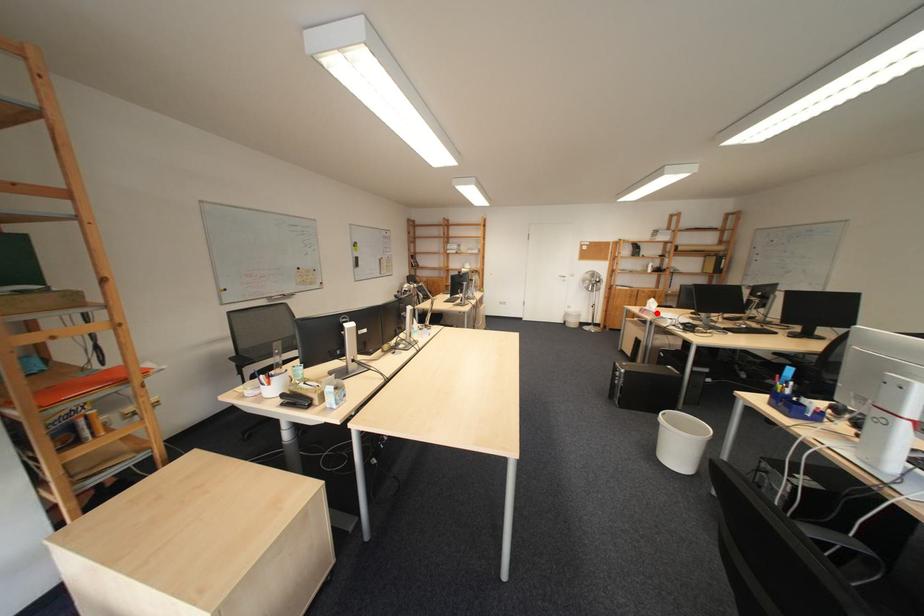
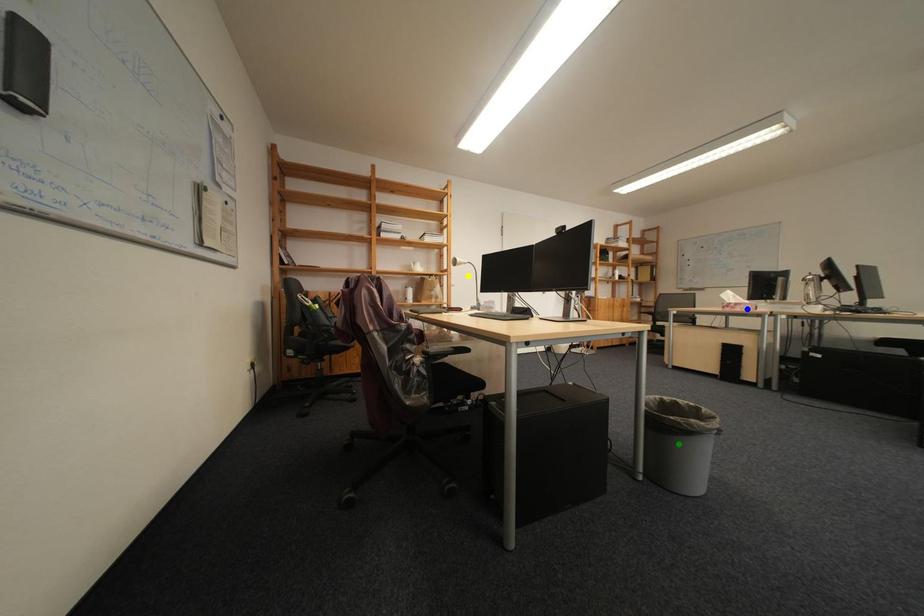
Question: I am providing you with two images of the same scene from different viewpoints. A red point is marked on the first image. You are given multiple points on the second image. Can you choose the point in image 2 that corresponds to the point in image 1?

Choices:
 (A) yellow point
 (B) blue point
 (C) green point

Answer: (B)